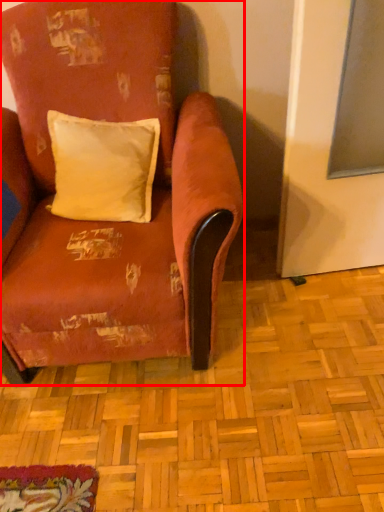
Question: From the image's perspective, considering the relative positions of chair (annotated by the red box) and pillow in the image provided, where is chair (annotated by the red box) located with respect to the staircase?

Choices:
 (A) below
 (B) above

Answer: (A)